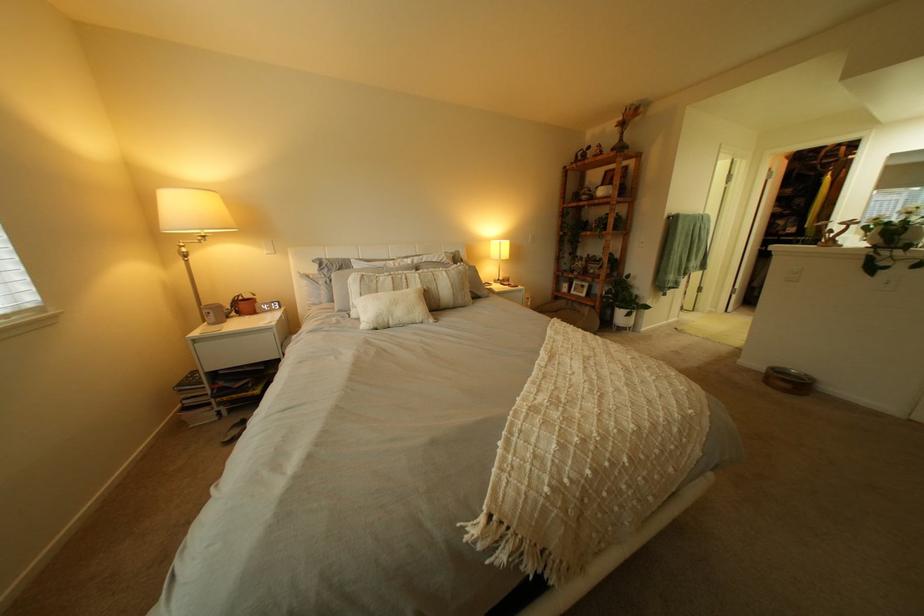
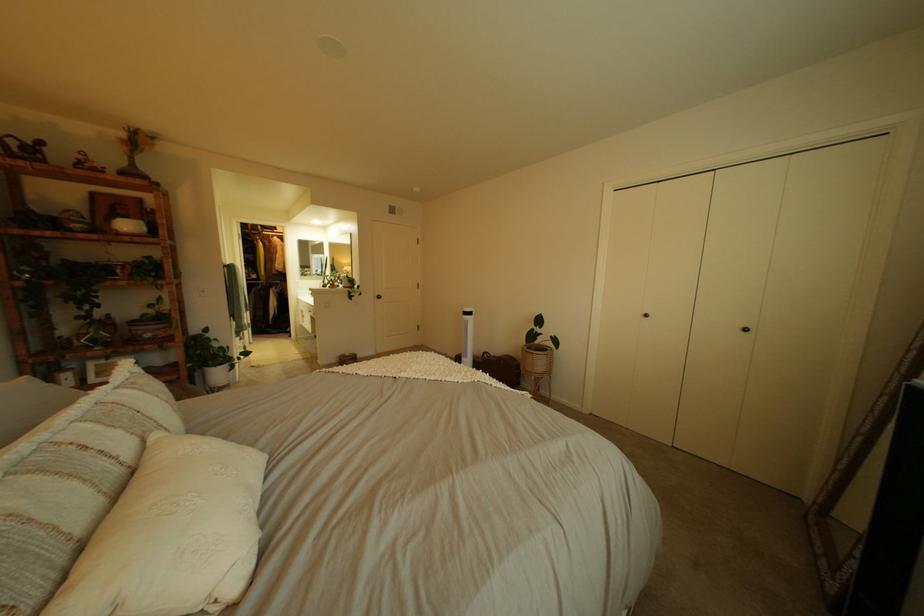
Where in the second image is the point corresponding to pixel 637 120 from the first image?

(139, 137)